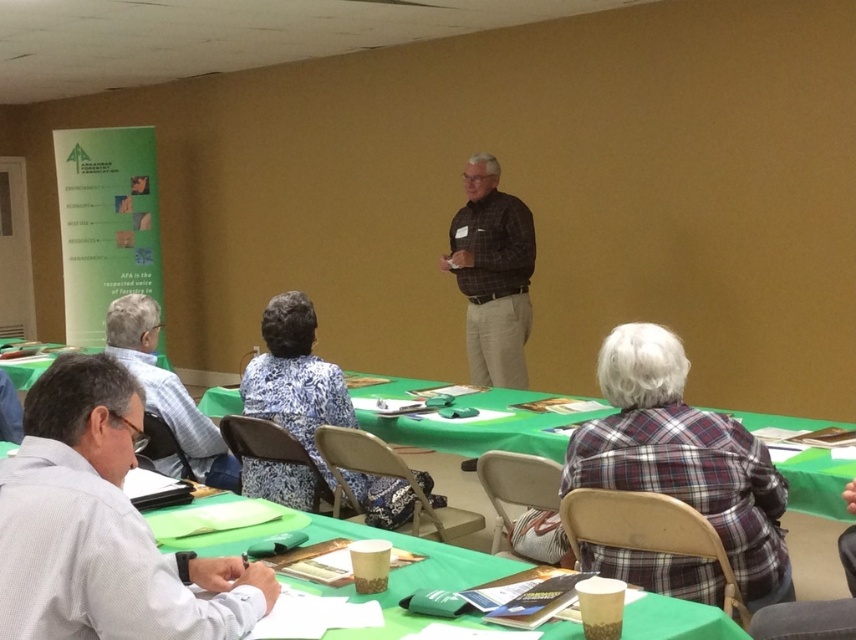
You are a participant in this workshop and need to reach the green fabric table at lower center from your current position near the plaid fabric shirt at lower right. Can you walk directly to it without moving around any obstacles?

The plaid fabric shirt at lower right is positioned under the green fabric table at lower center, so you cannot walk directly to the green fabric table at lower center from the plaid fabric shirt at lower right without moving around obstacles since the shirt is located beneath the table.

You are a photographer standing at the camera position in the scene. You want to take a closeup photo of the plaid fabric shirt at lower right without moving the shirt. Can you adjust your camera to zoom in enough to capture the shirt clearly?

The plaid fabric shirt at lower right is 6.93 feet away from the camera. If your camera has a zoom lens capable of focusing on subjects at that distance, you can adjust the zoom to capture the shirt clearly without moving it.

You are a service robot in the room. You need to deliver a document to the gray fabric shirt at lower left from the black checkered shirt at center. What is the minimum distance you need to travel?

The minimum distance you need to travel is 2.09 meters between the black checkered shirt at center and the gray fabric shirt at lower left.